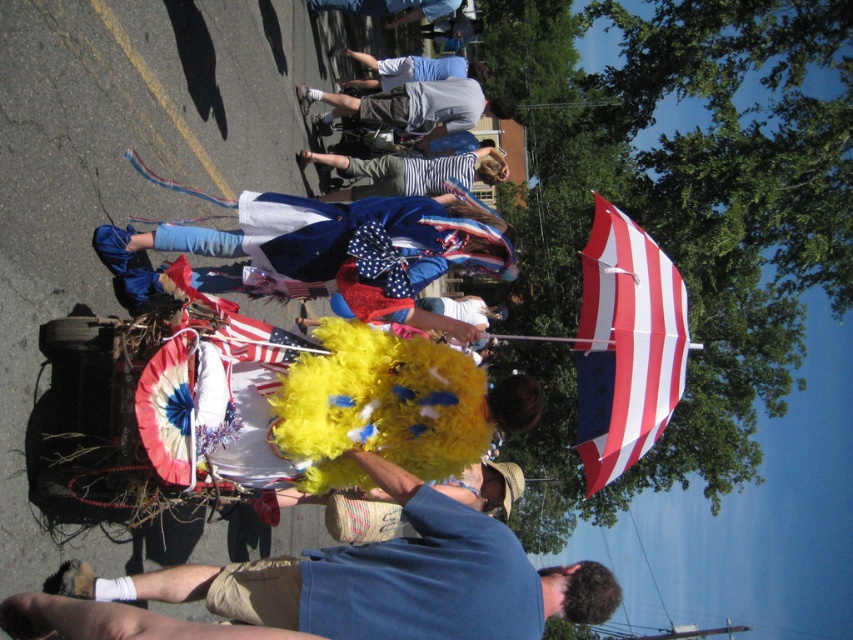
Who is more distant from viewer, (633, 330) or (300, 108)?

The point (300, 108) is behind.

Can you confirm if red and white striped umbrella at upper right is positioned below gray cotton shorts at center?

Indeed, red and white striped umbrella at upper right is positioned under gray cotton shorts at center.

Between point (616, 396) and point (448, 84), which one is positioned behind?

The point (448, 84) is behind.

Where is `red and white striped umbrella at upper right`? Image resolution: width=853 pixels, height=640 pixels. red and white striped umbrella at upper right is located at coordinates (625, 344).

Where is `red and white striped umbrella at upper right`? The height and width of the screenshot is (640, 853). red and white striped umbrella at upper right is located at coordinates (625, 344).

Is striped fabric at center to the right of blue fabric flag at center from the viewer's perspective?

Indeed, striped fabric at center is positioned on the right side of blue fabric flag at center.

Is point (426, 164) positioned after point (376, 257)?

That is True.

Where is `striped fabric at center`? striped fabric at center is located at coordinates (410, 172).